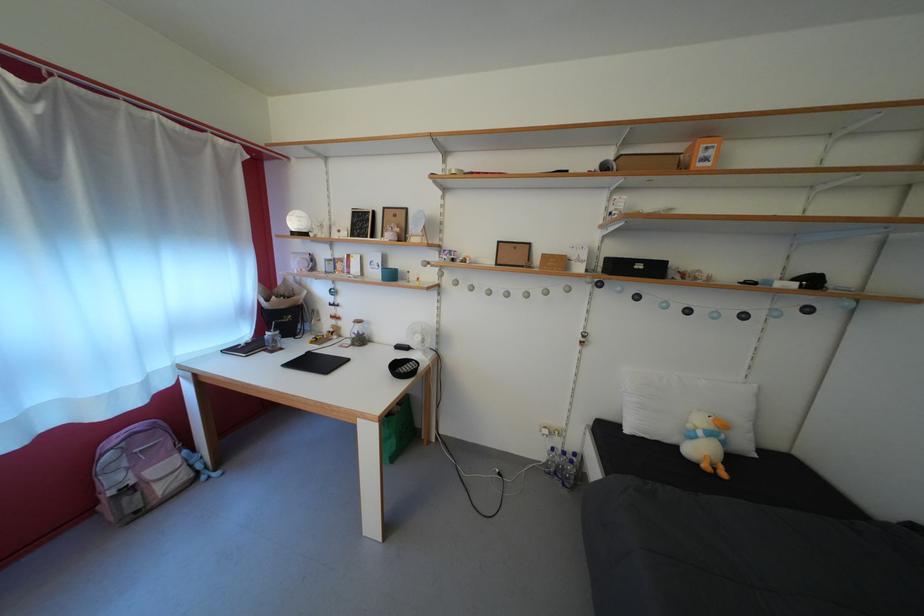
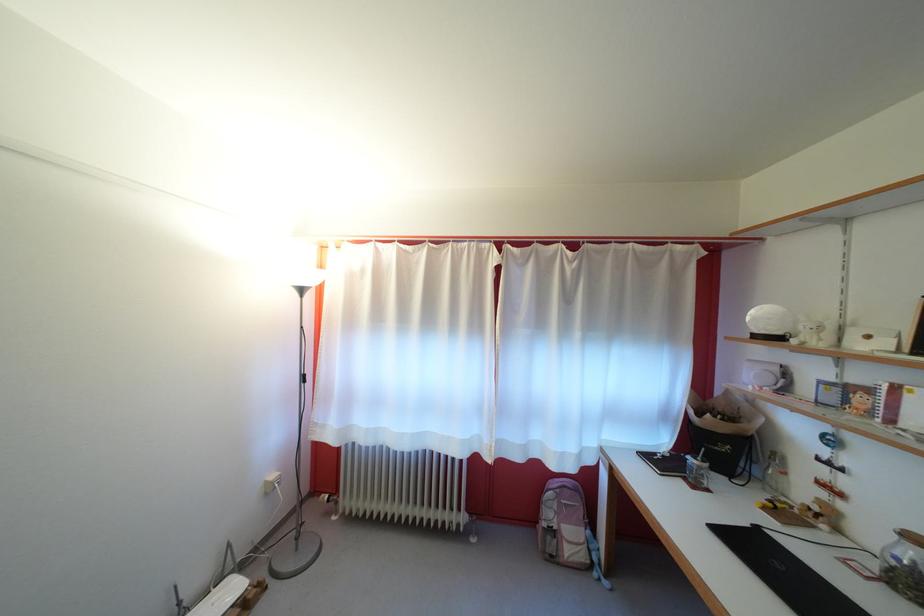
The point at (x=282, y=342) is marked in the first image. Where is the corresponding point in the second image?

(708, 474)